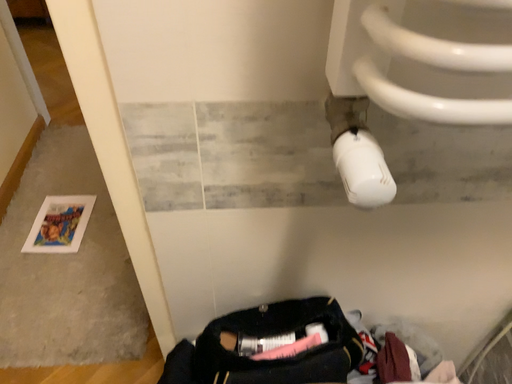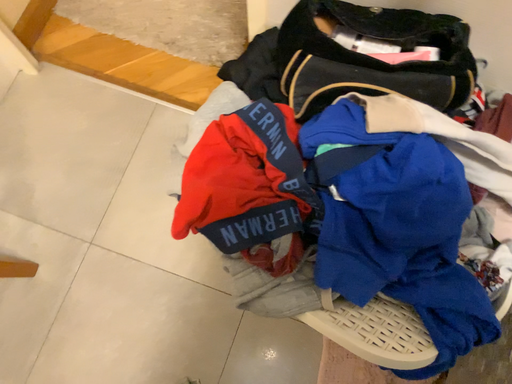
Question: Which way did the camera rotate in the video?

Choices:
 (A) rotated right
 (B) rotated left

Answer: (B)